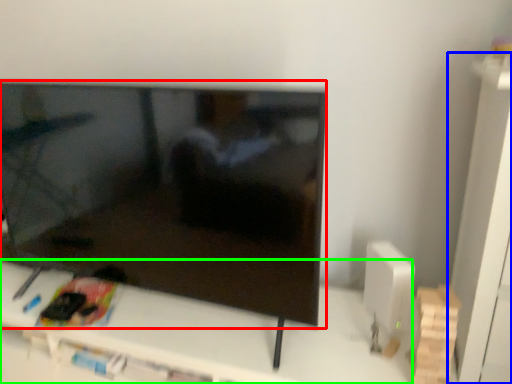
Question: Which is nearer to the television (highlighted by a red box)? tv cabinet (highlighted by a blue box) or furniture (highlighted by a green box).

Choices:
 (A) tv cabinet
 (B) furniture

Answer: (B)